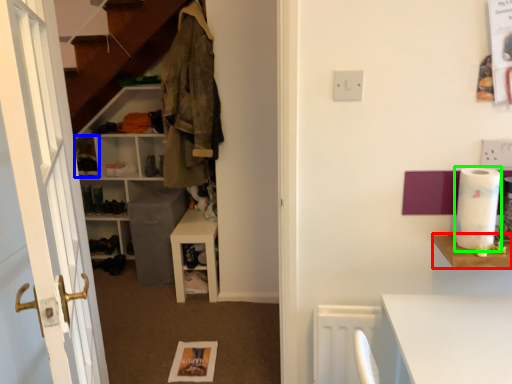
Question: Which is nearer to the shelf (highlighted by a red box)? cabinet (highlighted by a blue box) or toilet paper (highlighted by a green box).

Choices:
 (A) cabinet
 (B) toilet paper

Answer: (B)